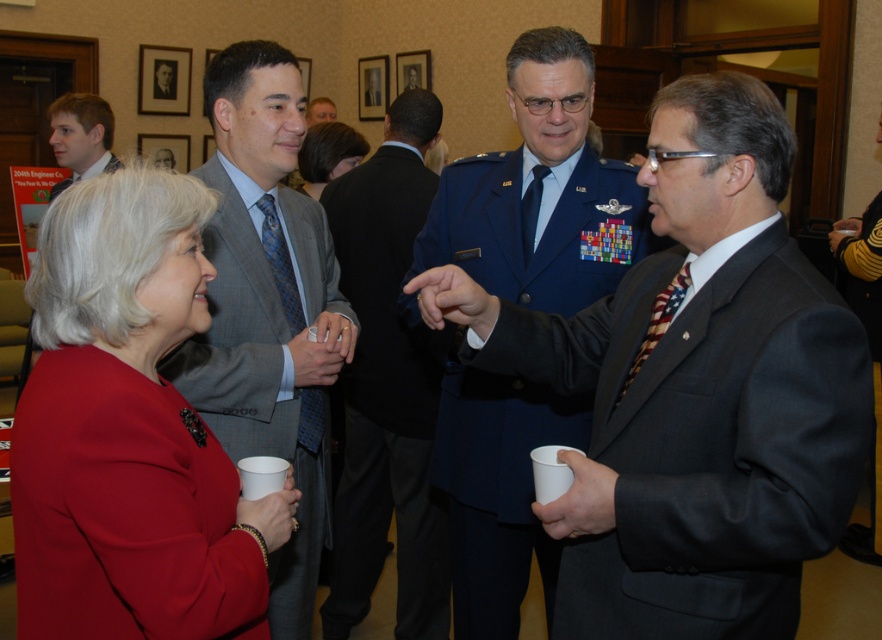
You are standing at the entrance of the room and want to greet both the person in the yellow striped sweater at lower right and the person in the matte black suit at center. Which individual should you approach first based on their positions?

The yellow striped sweater at lower right is to the right of the matte black suit at center, so you should approach the matte black suit at center first since it is closer to your left side when entering the room.

What is the color of the object located at point (861, 268)?

The object at point (861, 268) is the yellow striped sweater at lower right.